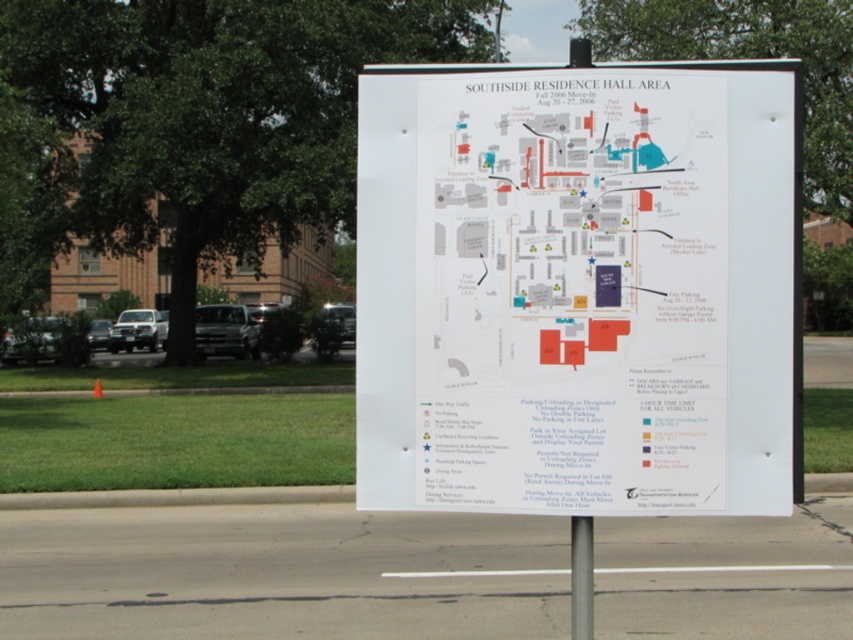
Between white paper map at center and metallic pole at lower center, which one is positioned higher?

white paper map at center is above.

Does point (625, 397) come closer to viewer compared to point (581, 541)?

Yes.

Describe the element at coordinates (572, 292) in the screenshot. I see `white paper map at center` at that location.

Where is `white paper map at center`? The image size is (853, 640). white paper map at center is located at coordinates (572, 292).